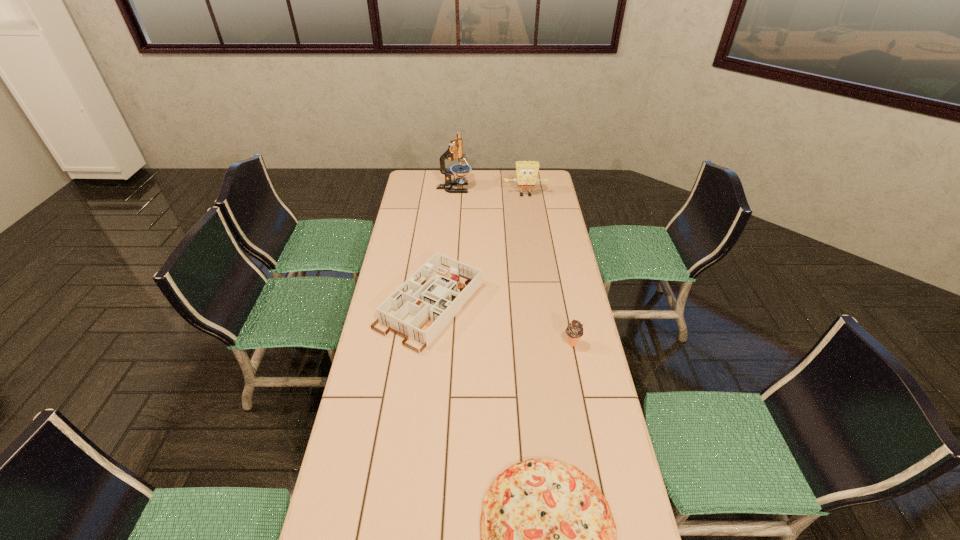
At what (x,y) coordinates should I click in order to perform the action: click on free space between the second shortest object and the sponge. Please return your answer as a coordinate pair (x, y). Image resolution: width=960 pixels, height=540 pixels. Looking at the image, I should click on (478, 251).

Locate an element on the screen. This screenshot has width=960, height=540. vacant point located between the second shortest object and the third shortest object is located at coordinates (501, 325).

What are the coordinates of `free space between the fourth tallest object and the third shortest object` in the screenshot? It's located at (501, 325).

The height and width of the screenshot is (540, 960). What are the coordinates of `vacant area that lies between the icecream and the dollhouse` in the screenshot? It's located at (501, 325).

The image size is (960, 540). In order to click on vacant point located between the second tallest object and the tallest object in this screenshot , I will do `click(490, 192)`.

You are a GUI agent. You are given a task and a screenshot of the screen. Output one action in this format:
    pyautogui.click(x=<x>, y=<y>)
    Task: Click on the unoccupied position between the icecream and the microscope
    
    Given the screenshot: What is the action you would take?
    pyautogui.click(x=513, y=266)

This screenshot has width=960, height=540. I want to click on object that is the third nearest to the nearest object, so click(527, 171).

At what (x,y) coordinates should I click in order to perform the action: click on object that can be found as the fourth closest to the icecream. Please return your answer as a coordinate pair (x, y). The height and width of the screenshot is (540, 960). Looking at the image, I should click on (455, 150).

Where is `vacant area that satisfies the following two spatial constraints: 1. at the eyepiece of the icecream; 2. on the right side of the microscope`? vacant area that satisfies the following two spatial constraints: 1. at the eyepiece of the icecream; 2. on the right side of the microscope is located at coordinates (442, 343).

This screenshot has height=540, width=960. I want to click on free location that satisfies the following two spatial constraints: 1. at the eyepiece of the tallest object; 2. on the left side of the third shortest object, so click(442, 343).